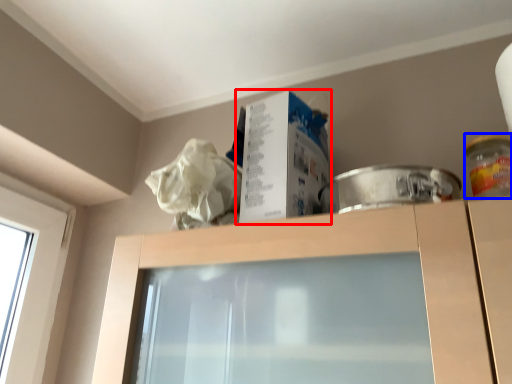
Question: Which object appears closest to the camera in this image, box (highlighted by a red box) or glass jar (highlighted by a blue box)?

Choices:
 (A) box
 (B) glass jar

Answer: (B)